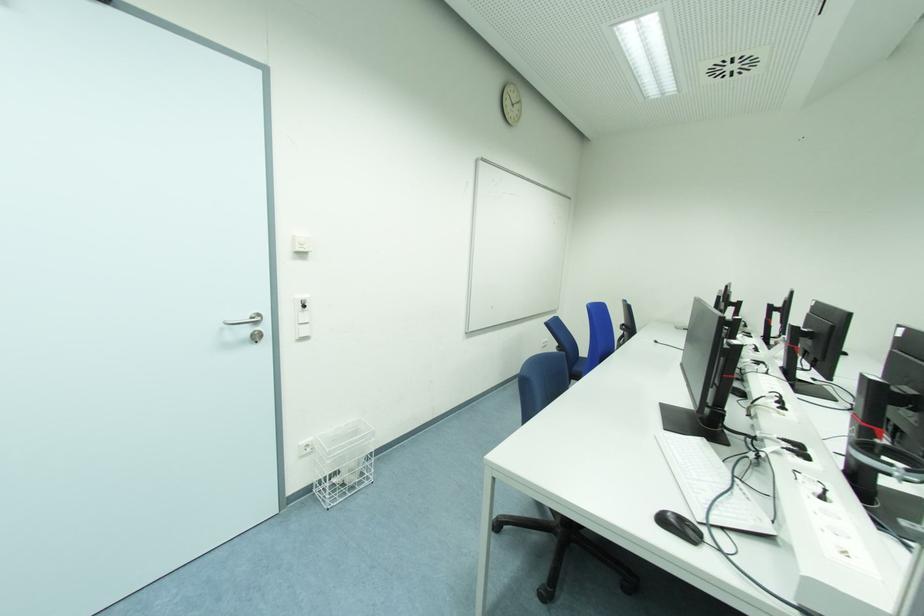
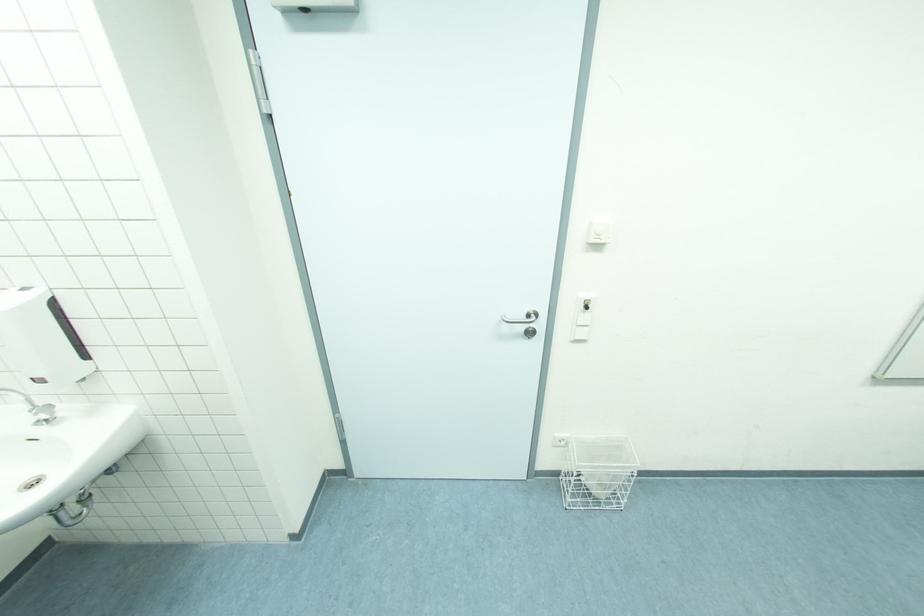
How did the camera likely rotate?

The camera rotated toward left-down.